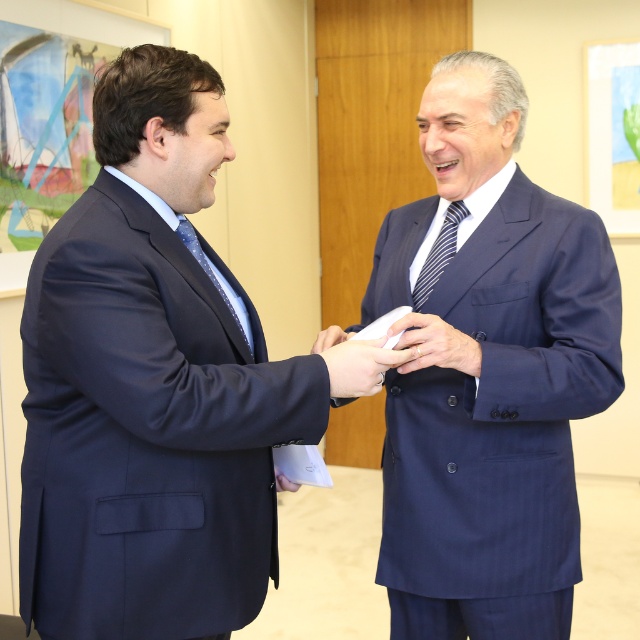
Can you confirm if matte blue suit at left is thinner than striped fabric tie at center?

No, matte blue suit at left is not thinner than striped fabric tie at center.

Between point (307, 410) and point (420, 291), which one is positioned behind?

Positioned behind is point (420, 291).

The image size is (640, 640). What do you see at coordinates (150, 387) in the screenshot?
I see `matte blue suit at left` at bounding box center [150, 387].

You are a GUI agent. You are given a task and a screenshot of the screen. Output one action in this format:
    pyautogui.click(x=<x>, y=<y>)
    Task: Click on the matte blue suit at left
    
    Given the screenshot: What is the action you would take?
    pyautogui.click(x=150, y=387)

Does white paper at center have a greater height compared to shiny blue tie at left?

No.

What are the coordinates of `white paper at center` in the screenshot? It's located at (356, 364).

I want to click on white paper at center, so click(356, 364).

Find the location of a particular element. blue pinstripe suit at center is located at coordinates (490, 376).

Is point (563, 492) farther from viewer compared to point (410, 324)?

Yes, point (563, 492) is behind point (410, 324).

At what (x,y) coordinates should I click in order to perform the action: click on blue pinstripe suit at center. Please return your answer as a coordinate pair (x, y). This screenshot has height=640, width=640. Looking at the image, I should click on (490, 376).